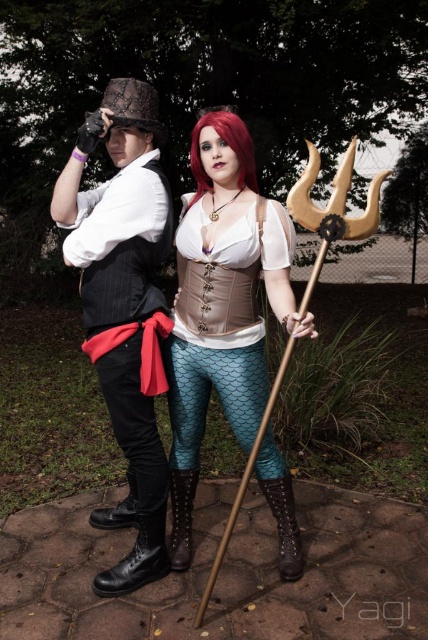
Who is positioned more to the right, teal fishscale leggings at center or leather lace-up boot at lower left?

From the viewer's perspective, teal fishscale leggings at center appears more on the right side.

Can you confirm if teal fishscale leggings at center is bigger than leather lace-up boot at lower left?

Yes.

This screenshot has height=640, width=428. I want to click on teal fishscale leggings at center, so click(223, 289).

Locate an element on the screen. This screenshot has height=640, width=428. teal fishscale leggings at center is located at coordinates (223, 289).

Can you confirm if teal fishscale leggings at center is positioned below matte black vest at left?

Indeed, teal fishscale leggings at center is positioned under matte black vest at left.

What do you see at coordinates (223, 289) in the screenshot? The width and height of the screenshot is (428, 640). I see `teal fishscale leggings at center` at bounding box center [223, 289].

Describe the element at coordinates (223, 289) in the screenshot. I see `teal fishscale leggings at center` at that location.

Locate an element on the screen. teal fishscale leggings at center is located at coordinates (223, 289).

Can you confirm if matte black vest at left is shorter than brown leather boot at lower center?

Incorrect, matte black vest at left's height does not fall short of brown leather boot at lower center's.

Who is positioned more to the right, matte black vest at left or brown leather boot at lower center?

From the viewer's perspective, brown leather boot at lower center appears more on the right side.

Does point (121, 120) come in front of point (291, 502)?

Yes, it is.

Locate an element on the screen. matte black vest at left is located at coordinates coord(124,308).